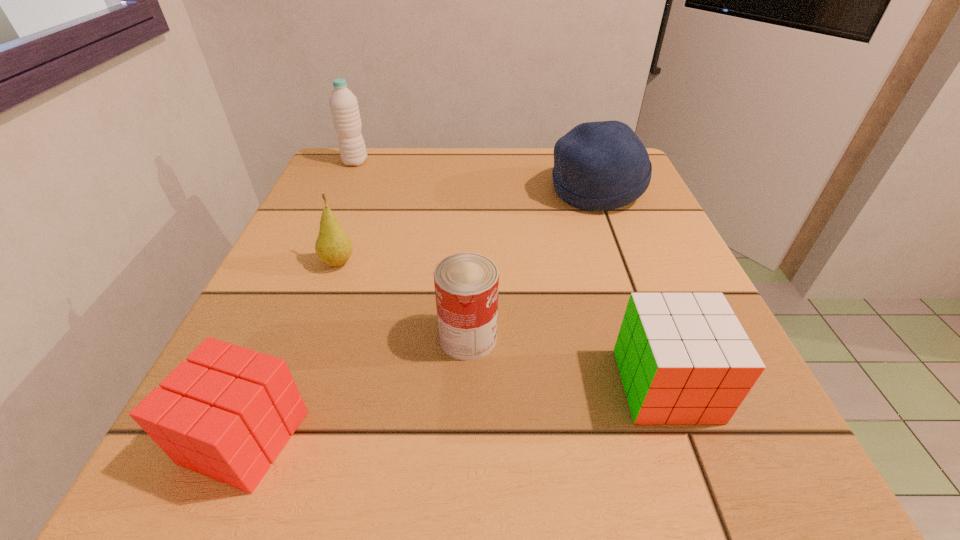
The width and height of the screenshot is (960, 540). Find the location of `cube that is at the right edge`. cube that is at the right edge is located at coordinates (684, 358).

Find the location of a particular element. This screenshot has height=540, width=960. object at the far left corner is located at coordinates (344, 107).

You are a GUI agent. You are given a task and a screenshot of the screen. Output one action in this format:
    pyautogui.click(x=<x>, y=<y>)
    Task: Click on the object present at the near left corner
    
    Given the screenshot: What is the action you would take?
    pyautogui.click(x=226, y=413)

Where is `object at the far right corner`? The width and height of the screenshot is (960, 540). object at the far right corner is located at coordinates (598, 166).

Where is `object that is at the near right corner`? This screenshot has width=960, height=540. object that is at the near right corner is located at coordinates (684, 358).

The image size is (960, 540). In the image, there is a desktop. Find the location of `vacant space at the far edge`. vacant space at the far edge is located at coordinates (467, 147).

Image resolution: width=960 pixels, height=540 pixels. Identify the location of vacant area at the near edge. (533, 485).

Identify the location of free space at the left edge of the desktop. (241, 335).

Image resolution: width=960 pixels, height=540 pixels. Find the location of `vacant space at the right edge`. vacant space at the right edge is located at coordinates (636, 215).

Locate an element on the screen. The height and width of the screenshot is (540, 960). free space at the far left corner of the desktop is located at coordinates (327, 161).